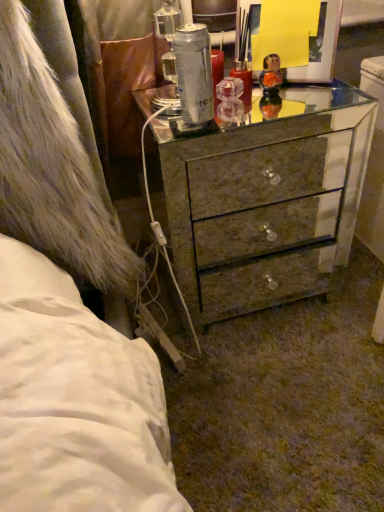
Locate an element on the screen. The height and width of the screenshot is (512, 384). free space in front of metallic mirrored chest of drawers at center is located at coordinates (274, 388).